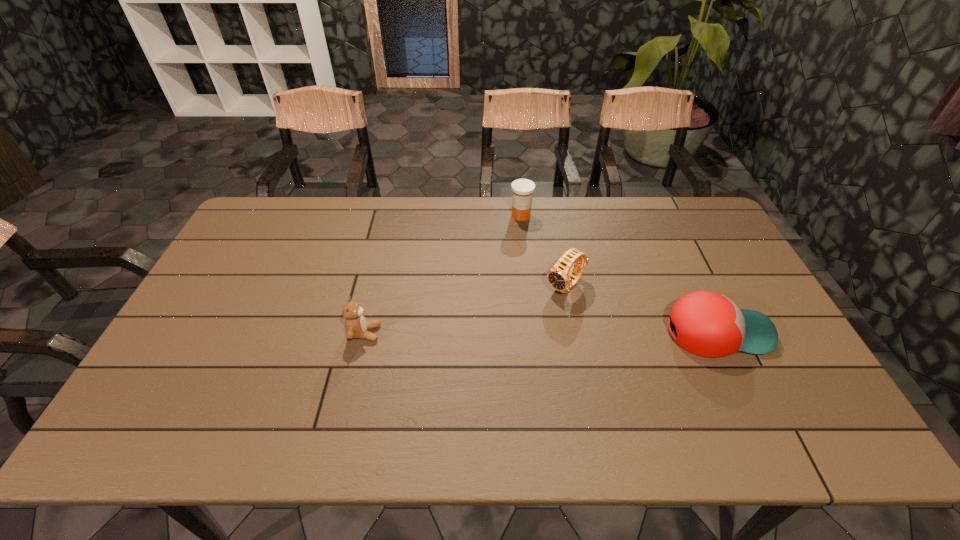
Identify the location of free spot on the desktop that is between the leftmost object and the baseball cap and is positioned on the face of the watch. The image size is (960, 540). (514, 333).

Find the location of `free space on the desktop that is between the teddy bear and the rightmost object and is positioned on the label of the medicine`. free space on the desktop that is between the teddy bear and the rightmost object and is positioned on the label of the medicine is located at coordinates (562, 333).